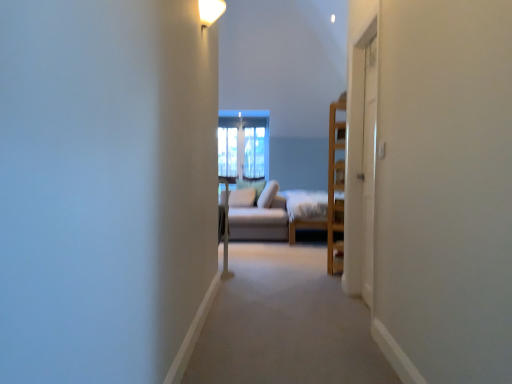
Find the location of a particular element. This screenshot has height=384, width=512. beige fabric couch at center is located at coordinates (257, 215).

Measure the distance between point (362, 45) and camera.

Point (362, 45) and camera are 3.10 meters apart.

This screenshot has height=384, width=512. What do you see at coordinates (243, 144) in the screenshot?
I see `clear glass window at center` at bounding box center [243, 144].

Describe the element at coordinates (306, 211) in the screenshot. I see `light brown wooden bed frame at center` at that location.

What do you see at coordinates (210, 11) in the screenshot? I see `white glossy light fixture at upper center` at bounding box center [210, 11].

Find the location of a particular element. The height and width of the screenshot is (384, 512). beige fabric couch at center is located at coordinates (257, 215).

From the image's perspective, does light brown wooden bed frame at center appear lower than beige fabric couch at center?

Actually, light brown wooden bed frame at center appears above beige fabric couch at center in the image.

Does light brown wooden bed frame at center turn towards beige fabric couch at center?

Yes, light brown wooden bed frame at center is oriented towards beige fabric couch at center.

Between light brown wooden bed frame at center and beige fabric couch at center, which one appears on the left side from the viewer's perspective?

Positioned to the left is beige fabric couch at center.

Considering the sizes of light brown wooden bed frame at center and beige fabric couch at center in the image, is light brown wooden bed frame at center bigger or smaller than beige fabric couch at center?

Considering their sizes, light brown wooden bed frame at center takes up more space than beige fabric couch at center.

From the picture: Does white wood screen door at right, acting as the first screen door starting from the right, have a lesser width compared to white wooden screen door at right, which ranks as the 2th screen door in right-to-left order?

Yes.

From a real-world perspective, which object rests below the other?

white wood screen door at right, which is the second screen door in left-to-right order.

Relative to white wooden screen door at right, the 1th screen door viewed from the left, is white wood screen door at right, acting as the first screen door starting from the right, in front or behind?

white wood screen door at right, acting as the first screen door starting from the right, is behind white wooden screen door at right, the 1th screen door viewed from the left.

You are a GUI agent. You are given a task and a screenshot of the screen. Output one action in this format:
    pyautogui.click(x=<x>, y=<y>)
    Task: Click on the light fixture above the clear glass window at center (from a real-world perspective)
    
    Given the screenshot: What is the action you would take?
    pyautogui.click(x=210, y=11)

In the scene shown: From a real-world perspective, who is located higher, clear glass window at center or white glossy light fixture at upper center?

white glossy light fixture at upper center is physically above.

Is clear glass window at center aimed at white glossy light fixture at upper center?

Yes, clear glass window at center is facing white glossy light fixture at upper center.

Are clear glass window at center and white glossy light fixture at upper center making contact?

clear glass window at center and white glossy light fixture at upper center are not in contact.

From the image's perspective, which is above, light brown wooden bed frame at center or white wood screen door at right, which is the second screen door in left-to-right order?

white wood screen door at right, which is the second screen door in left-to-right order, is shown above in the image.

Could you tell me if light brown wooden bed frame at center is facing white wood screen door at right, which is the second screen door in left-to-right order?

No.

Are light brown wooden bed frame at center and white wood screen door at right, which is the second screen door in left-to-right order, beside each other?

No, light brown wooden bed frame at center is not beside white wood screen door at right, which is the second screen door in left-to-right order.

Consider the image. Could you measure the distance between light brown wooden bed frame at center and white wood screen door at right, which is the second screen door in left-to-right order?

8.61 feet.

Image resolution: width=512 pixels, height=384 pixels. In order to click on screen door that is the 2nd one when counting rightward from the beige fabric couch at center in this screenshot , I will do `click(369, 167)`.

Looking at this image, can you confirm if beige fabric couch at center is shorter than white wood screen door at right, acting as the first screen door starting from the right?

Yes, beige fabric couch at center is shorter than white wood screen door at right, acting as the first screen door starting from the right.

Is point (248, 230) positioned behind point (366, 220)?

Yes, point (248, 230) is farther from viewer.

Considering the relative sizes of beige fabric couch at center and white wood screen door at right, which is the second screen door in left-to-right order, in the image provided, is beige fabric couch at center bigger than white wood screen door at right, which is the second screen door in left-to-right order,?

Yes, beige fabric couch at center is bigger than white wood screen door at right, which is the second screen door in left-to-right order.

From a real-world perspective, which object stands above the other?

white wooden screen door at right, the 1th screen door viewed from the left, from a real-world perspective.

Is beige fabric couch at center in contact with white wooden screen door at right, which ranks as the 2th screen door in right-to-left order?

beige fabric couch at center and white wooden screen door at right, which ranks as the 2th screen door in right-to-left order, are clearly separated.

Looking at this image, is beige fabric couch at center spatially inside white wooden screen door at right, which ranks as the 2th screen door in right-to-left order, or outside of it?

beige fabric couch at center is spatially situated outside white wooden screen door at right, which ranks as the 2th screen door in right-to-left order.

Measure the distance between beige fabric couch at center and white wooden screen door at right, the 1th screen door viewed from the left.

A distance of 8.55 feet exists between beige fabric couch at center and white wooden screen door at right, the 1th screen door viewed from the left.

Is light brown wooden bed frame at center bigger or smaller than clear glass window at center?

Considering their sizes, light brown wooden bed frame at center takes up more space than clear glass window at center.

At what (x,y) coordinates should I click in order to perform the action: click on window above the light brown wooden bed frame at center (from the image's perspective). Please return your answer as a coordinate pair (x, y). This screenshot has height=384, width=512. Looking at the image, I should click on (243, 144).

How different are the orientations of light brown wooden bed frame at center and clear glass window at center in degrees?

There is a 90.8-degree angle between the facing directions of light brown wooden bed frame at center and clear glass window at center.

From a real-world perspective, is light brown wooden bed frame at center physically below clear glass window at center?

Yes, from a real-world perspective, light brown wooden bed frame at center is below clear glass window at center.

This screenshot has width=512, height=384. I want to click on bed frame above the beige fabric couch at center (from the image's perspective), so click(x=306, y=211).

The height and width of the screenshot is (384, 512). I want to click on screen door above the white wood screen door at right, which is the second screen door in left-to-right order (from a real-world perspective), so click(x=360, y=160).

When comparing their distances from clear glass window at center, does light brown wooden bed frame at center or beige fabric couch at center seem further?

light brown wooden bed frame at center is positioned further to the anchor clear glass window at center.

When comparing their distances from clear glass window at center, does white wood screen door at right, which is the second screen door in left-to-right order, or white wooden screen door at right, which ranks as the 2th screen door in right-to-left order, seem further?

white wood screen door at right, which is the second screen door in left-to-right order, is further to clear glass window at center.

Based on their spatial positions, is white glossy light fixture at upper center or clear glass window at center closer to light brown wooden bed frame at center?

clear glass window at center.

Estimate the real-world distances between objects in this image. Which object is further from white wooden screen door at right, the 1th screen door viewed from the left, light brown wooden bed frame at center or clear glass window at center?

clear glass window at center lies further to white wooden screen door at right, the 1th screen door viewed from the left, than the other object.

Consider the image. Based on their spatial positions, is beige fabric couch at center or white wood screen door at right, acting as the first screen door starting from the right, closer to clear glass window at center?

Based on the image, beige fabric couch at center appears to be nearer to clear glass window at center.

From the image, which object appears to be farther from light brown wooden bed frame at center, clear glass window at center or white wood screen door at right, acting as the first screen door starting from the right?

white wood screen door at right, acting as the first screen door starting from the right, lies further to light brown wooden bed frame at center than the other object.

Considering their positions, is beige fabric couch at center positioned further to white wooden screen door at right, which ranks as the 2th screen door in right-to-left order, than clear glass window at center?

clear glass window at center.

Based on their spatial positions, is beige fabric couch at center or white glossy light fixture at upper center closer to light brown wooden bed frame at center?

beige fabric couch at center.

Identify the location of bed frame between white glossy light fixture at upper center and clear glass window at center from front to back. The height and width of the screenshot is (384, 512). (306, 211).

Locate an element on the screen. This screenshot has height=384, width=512. screen door between white wooden screen door at right, the 1th screen door viewed from the left, and beige fabric couch at center in the front-back direction is located at coordinates pos(369,167).

You are a GUI agent. You are given a task and a screenshot of the screen. Output one action in this format:
    pyautogui.click(x=<x>, y=<y>)
    Task: Click on the light fixture between white wooden screen door at right, the 1th screen door viewed from the left, and clear glass window at center from front to back
    This screenshot has height=384, width=512.
    Given the screenshot: What is the action you would take?
    pyautogui.click(x=210, y=11)

Find the location of a particular element. The image size is (512, 384). studio couch positioned between white glossy light fixture at upper center and clear glass window at center from near to far is located at coordinates (257, 215).